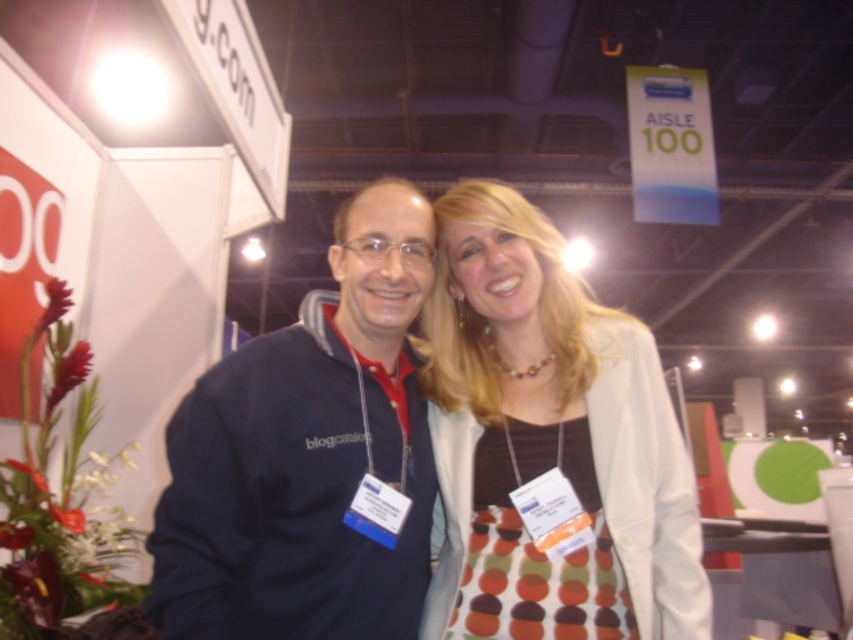
You are at a convention and want to take a photo of the two people in the scene. The photographer is standing at point A, which is at the same position as point (523, 209). You need to determine if the person at point B, located at (374, 336), will be visible in the photo. Based on their positions, will the person at point B be visible in the photo taken from point A?

Since point (523, 209) is behind point (374, 336), the person at point B will be visible in the photo taken from point A because the photographer is positioned behind them, allowing a clear view.

You are a photographer at a trade show. You need to capture a photo of the two people wearing the polka dot fabric dress at center and dark blue fleece at center. Which one will appear larger in the photo?

The polka dot fabric dress at center will appear larger in the photo because it is bigger than the dark blue fleece at center.